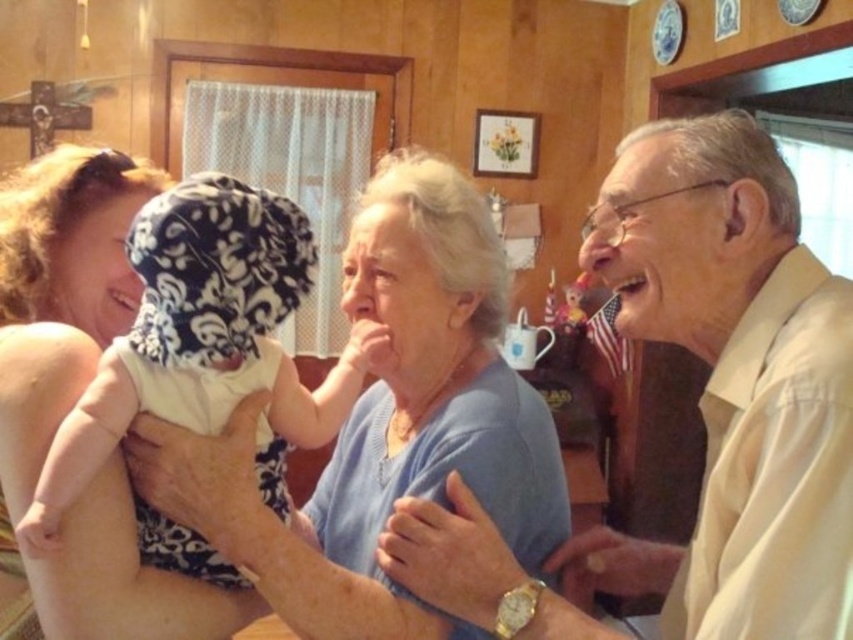
Question: Does light beige shirt at center lie behind smooth skin mouth at upper right?

Choices:
 (A) yes
 (B) no

Answer: (B)

Question: Which point appears farthest from the camera in this image?

Choices:
 (A) (766, 493)
 (B) (219, 316)
 (C) (645, 282)

Answer: (C)

Question: From the image, what is the correct spatial relationship of blue knit sweater at center in relation to smooth skin mouth at upper right?

Choices:
 (A) right
 (B) left

Answer: (B)

Question: Which of the following is the closest to the observer?

Choices:
 (A) smooth skin mouth at upper right
 (B) light beige shirt at center
 (C) blue knit sweater at center

Answer: (B)

Question: Which point is closer to the camera taking this photo?

Choices:
 (A) (834, 584)
 (B) (369, 509)
 (C) (624, 285)

Answer: (A)

Question: Is light beige shirt at center positioned before white cotton baby at center?

Choices:
 (A) no
 (B) yes

Answer: (B)